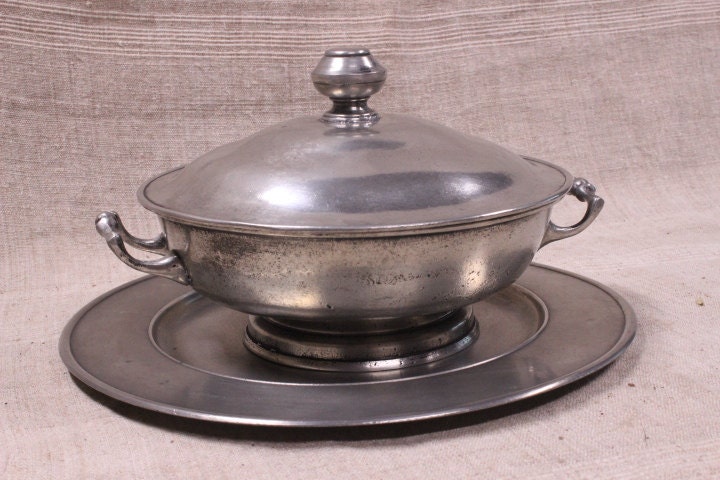
Locate an element on the screen. lid knob is located at coordinates (112, 228), (590, 199), (343, 70).